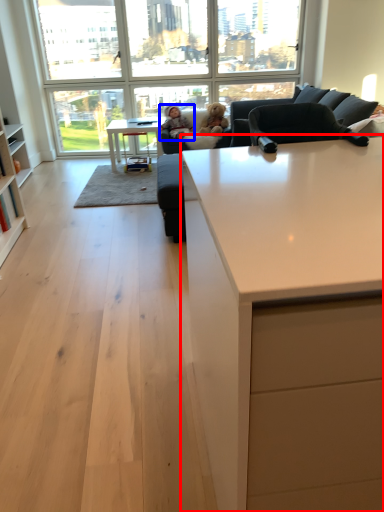
Question: Which object is closer to the camera taking this photo, countertop (highlighted by a red box) or person (highlighted by a blue box)?

Choices:
 (A) countertop
 (B) person

Answer: (A)